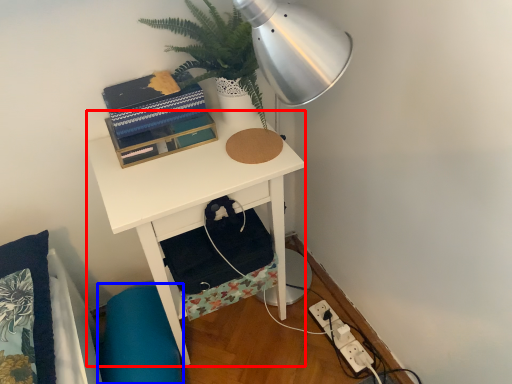
Question: Among these objects, which one is farthest to the camera, desk (highlighted by a red box) or swivel chair (highlighted by a blue box)?

Choices:
 (A) desk
 (B) swivel chair

Answer: (B)